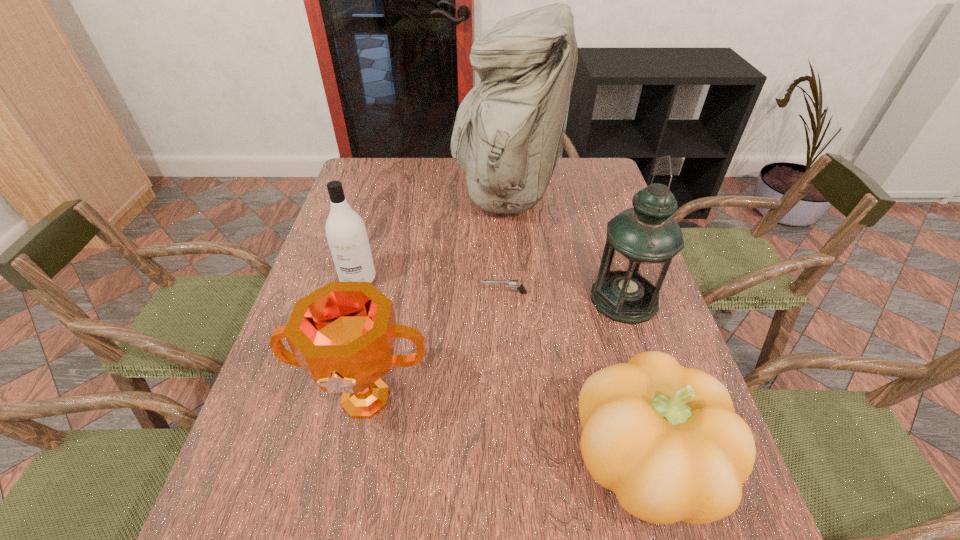
The width and height of the screenshot is (960, 540). I want to click on backpack, so click(507, 134).

At what (x,y) coordinates should I click in order to perform the action: click on the tallest object. Please return your answer as a coordinate pair (x, y). This screenshot has width=960, height=540. Looking at the image, I should click on (507, 134).

Where is `oil lamp`? oil lamp is located at coordinates (641, 241).

The width and height of the screenshot is (960, 540). What are the coordinates of `shampoo` in the screenshot? It's located at (346, 233).

Find the location of a particular element. This screenshot has height=540, width=960. award is located at coordinates (343, 334).

The image size is (960, 540). I want to click on pistol, so click(x=512, y=283).

Where is `vacant space located 0.230m on the front-facing side of the farthest object`? This screenshot has height=540, width=960. vacant space located 0.230m on the front-facing side of the farthest object is located at coordinates (386, 195).

Where is `vacant region located 0.370m on the front-facing side of the farthest object`? The image size is (960, 540). vacant region located 0.370m on the front-facing side of the farthest object is located at coordinates (345, 195).

Find the location of a particular element. free region located on the front-facing side of the farthest object is located at coordinates (356, 195).

Find the location of `free space located on the back of the oil lamp`. free space located on the back of the oil lamp is located at coordinates (598, 219).